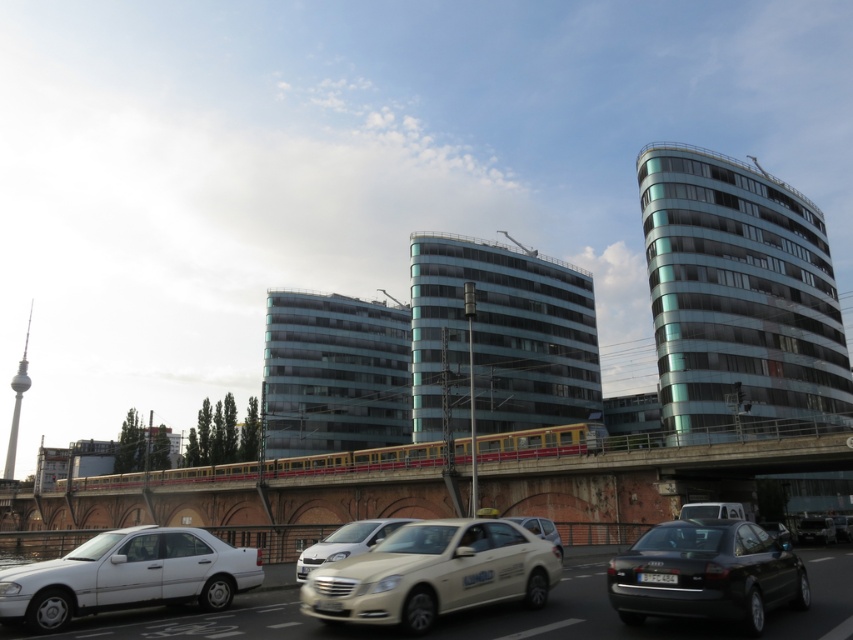
Which is in front, point (436, 544) or point (827, 520)?

Point (436, 544) is more forward.

Can you confirm if white glossy taxi at center is wider than metallic silver sedan at center?

No, white glossy taxi at center is not wider than metallic silver sedan at center.

Where is `white glossy taxi at center`? This screenshot has width=853, height=640. white glossy taxi at center is located at coordinates (433, 573).

Identify the location of white matte sedan at lower left. (x=128, y=576).

Does white matte sedan at lower left lie in front of white glossy sedan at center?

That is True.

Is point (209, 548) more distant than point (553, 532)?

That is False.

Where is `white matte sedan at lower left`? This screenshot has width=853, height=640. white matte sedan at lower left is located at coordinates (128, 576).

Can you confirm if white glossy car at lower center is thinner than metallic silver sedan at center?

No.

Who is more distant from viewer, (152, 628) or (827, 522)?

The point (827, 522) is behind.

The height and width of the screenshot is (640, 853). I want to click on white glossy car at lower center, so click(x=572, y=614).